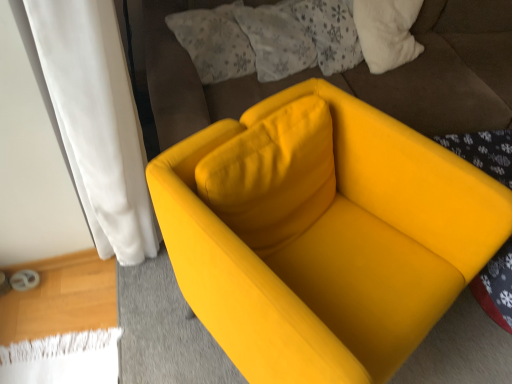
Question: Is fluffy white pillow at upper center, placed as the 1th pillow when sorted from left to right, bigger than fluffy white pillow at upper center, the 1th pillow viewed from the right?

Choices:
 (A) yes
 (B) no

Answer: (A)

Question: Can you see fluffy white pillow at upper center, marked as the second pillow in a right-to-left arrangement, touching fluffy white pillow at upper center, the 2th pillow from the left?

Choices:
 (A) no
 (B) yes

Answer: (A)

Question: Considering the relative positions of fluffy white pillow at upper center, marked as the second pillow in a right-to-left arrangement, and fluffy white pillow at upper center, the 2th pillow from the left, in the image provided, is fluffy white pillow at upper center, marked as the second pillow in a right-to-left arrangement, to the left of fluffy white pillow at upper center, the 2th pillow from the left, from the viewer's perspective?

Choices:
 (A) no
 (B) yes

Answer: (B)

Question: Is fluffy white pillow at upper center, the 2th pillow from the left, a part of fluffy white pillow at upper center, marked as the second pillow in a right-to-left arrangement?

Choices:
 (A) yes
 (B) no

Answer: (B)

Question: Considering the relative sizes of fluffy white pillow at upper center, marked as the second pillow in a right-to-left arrangement, and fluffy white pillow at upper center, the 2th pillow from the left, in the image provided, is fluffy white pillow at upper center, marked as the second pillow in a right-to-left arrangement, smaller than fluffy white pillow at upper center, the 2th pillow from the left,?

Choices:
 (A) no
 (B) yes

Answer: (A)

Question: Is point (193, 1) closer or farther from the camera than point (418, 210)?

Choices:
 (A) closer
 (B) farther

Answer: (B)

Question: In the image, is matte yellow armchair at center positioned in front of or behind matte yellow armchair at center?

Choices:
 (A) behind
 (B) front

Answer: (A)

Question: Do you think matte yellow armchair at center is within matte yellow armchair at center, or outside of it?

Choices:
 (A) inside
 (B) outside

Answer: (B)

Question: From the image's perspective, is matte yellow armchair at center positioned above or below matte yellow armchair at center?

Choices:
 (A) below
 (B) above

Answer: (B)

Question: Is fluffy white pillow at upper center, the 1th pillow viewed from the right, taller or shorter than fluffy white pillow at upper center, marked as the second pillow in a right-to-left arrangement?

Choices:
 (A) tall
 (B) short

Answer: (B)

Question: In terms of width, does fluffy white pillow at upper center, the 2th pillow from the left, look wider or thinner when compared to fluffy white pillow at upper center, marked as the second pillow in a right-to-left arrangement?

Choices:
 (A) wide
 (B) thin

Answer: (B)

Question: Do you think fluffy white pillow at upper center, the 2th pillow from the left, is within fluffy white pillow at upper center, placed as the 1th pillow when sorted from left to right, or outside of it?

Choices:
 (A) inside
 (B) outside

Answer: (B)

Question: In the image, is fluffy white pillow at upper center, the 1th pillow viewed from the right, positioned in front of or behind fluffy white pillow at upper center, marked as the second pillow in a right-to-left arrangement?

Choices:
 (A) behind
 (B) front

Answer: (A)

Question: Is fluffy white pillow at upper center, placed as the 1th pillow when sorted from left to right, to the left or to the right of fluffy white pillow at upper center, the 2th pillow from the left, in the image?

Choices:
 (A) right
 (B) left

Answer: (B)

Question: Relative to fluffy white pillow at upper center, the 1th pillow viewed from the right, is fluffy white pillow at upper center, placed as the 1th pillow when sorted from left to right, in front or behind?

Choices:
 (A) front
 (B) behind

Answer: (A)